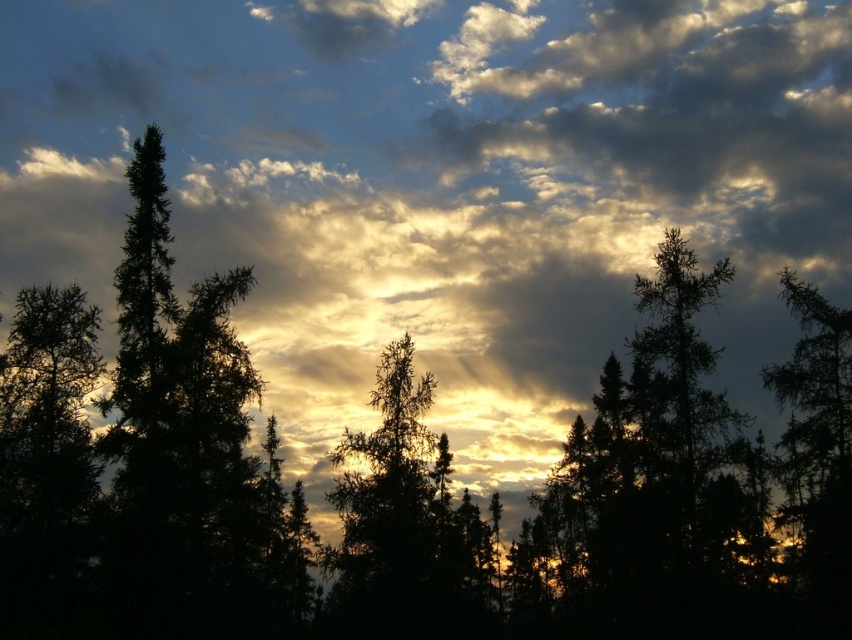
You are standing in a forest and want to take a photo of the silhouette pine at center. If your camera can focus on objects up to 30 meters away, will you need to move closer to capture it clearly?

The silhouette pine at center is 36.94 meters away from the viewer. Since the camera can only focus up to 30 meters, you need to move closer to ensure it is within the 30 meter range for clear focus.

You are a hiker standing in the forest and see the point marked at coordinates (401, 524). Which object in the scene does this point belong to?

The point at (401, 524) is on the silhouette pine at center.